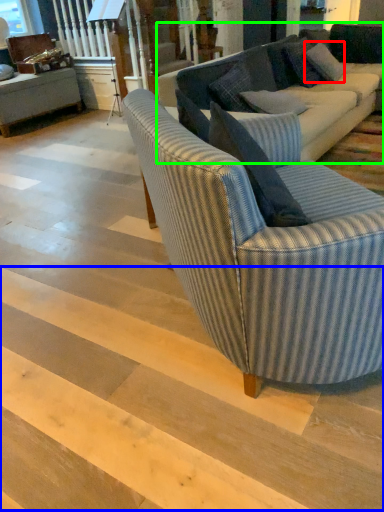
Question: Considering the real-world distances, which object is farthest from pillow (highlighted by a red box)? stairwell (highlighted by a blue box) or studio couch (highlighted by a green box)?

Choices:
 (A) stairwell
 (B) studio couch

Answer: (A)